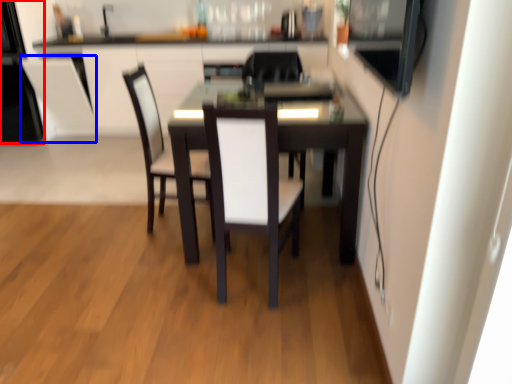
Question: Among these objects, which one is nearest to the camera, appliance (highlighted by a red box) or armchair (highlighted by a blue box)?

Choices:
 (A) appliance
 (B) armchair

Answer: (A)